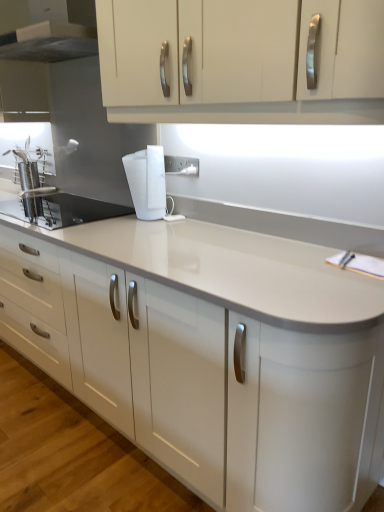
Question: From a real-world perspective, is white glossy countertop at center physically below brushed metal range hood at upper left?

Choices:
 (A) yes
 (B) no

Answer: (A)

Question: Can we say white glossy countertop at center lies outside brushed metal range hood at upper left?

Choices:
 (A) no
 (B) yes

Answer: (B)

Question: Is white glossy countertop at center at the right side of brushed metal range hood at upper left?

Choices:
 (A) no
 (B) yes

Answer: (A)

Question: Can you confirm if white glossy countertop at center is thinner than brushed metal range hood at upper left?

Choices:
 (A) no
 (B) yes

Answer: (A)

Question: Can you confirm if white glossy countertop at center is taller than brushed metal range hood at upper left?

Choices:
 (A) yes
 (B) no

Answer: (A)

Question: From the image's perspective, is white glossy countertop at center below brushed metal range hood at upper left?

Choices:
 (A) no
 (B) yes

Answer: (B)

Question: Can you confirm if white glossy cabinet at upper center is positioned to the left of brushed metal range hood at upper left?

Choices:
 (A) no
 (B) yes

Answer: (A)

Question: Is white glossy cabinet at upper center positioned in front of brushed metal range hood at upper left?

Choices:
 (A) yes
 (B) no

Answer: (A)

Question: From the image's perspective, is white glossy cabinet at upper center located above brushed metal range hood at upper left?

Choices:
 (A) no
 (B) yes

Answer: (A)

Question: Does white glossy cabinet at upper center appear on the right side of brushed metal range hood at upper left?

Choices:
 (A) yes
 (B) no

Answer: (A)

Question: From the image's perspective, is white glossy cabinet at upper center below brushed metal range hood at upper left?

Choices:
 (A) yes
 (B) no

Answer: (A)

Question: Could brushed metal range hood at upper left be considered to be inside white glossy cabinet at upper center?

Choices:
 (A) no
 (B) yes

Answer: (A)

Question: Is white plastic electric outlet at center wider than white glossy cabinet at upper center?

Choices:
 (A) no
 (B) yes

Answer: (A)